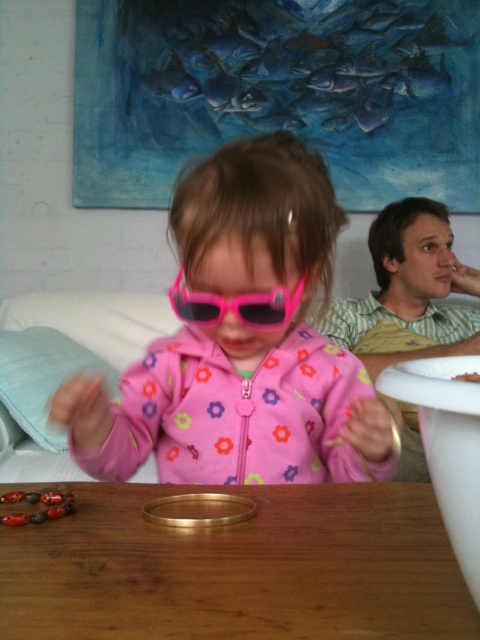
Question: Among these points, which one is farthest from the camera?

Choices:
 (A) (433, 545)
 (B) (259, 381)

Answer: (B)

Question: Estimate the real-world distances between objects in this image. Which object is closer to the green striped shirt at upper right?

Choices:
 (A) wooden table at center
 (B) light blue fabric pillow at lower left
 (C) pink matte sunglasses at center
 (D) white plastic bowl at upper right

Answer: (C)

Question: Does wooden table at center appear over white plastic bowl at upper right?

Choices:
 (A) yes
 (B) no

Answer: (B)

Question: Can you confirm if pink matte sunglasses at center is thinner than wooden table at center?

Choices:
 (A) yes
 (B) no

Answer: (A)

Question: Is pink matte sunglasses at center wider than wooden table at center?

Choices:
 (A) yes
 (B) no

Answer: (B)

Question: Which object appears farthest from the camera in this image?

Choices:
 (A) green striped shirt at upper right
 (B) pink plastic goggles at center
 (C) light blue fabric pillow at lower left
 (D) pink matte sunglasses at center

Answer: (C)